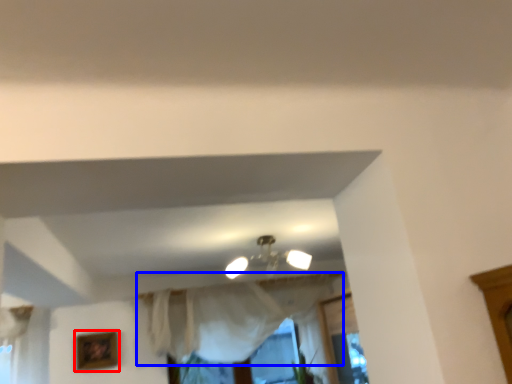
Question: Which of the following is the farthest to the observer, picture frame (highlighted by a red box) or curtain (highlighted by a blue box)?

Choices:
 (A) picture frame
 (B) curtain

Answer: (A)